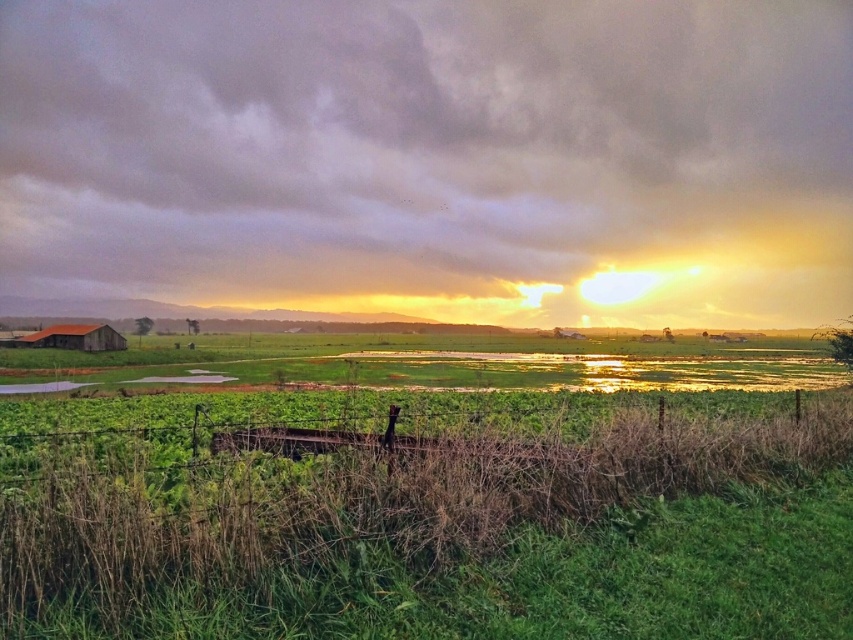
Question: Does cloudy sky at upper center appear over rustic wooden barn at lower left?

Choices:
 (A) yes
 (B) no

Answer: (A)

Question: Is cloudy sky at upper center wider than green grassy field at lower center?

Choices:
 (A) no
 (B) yes

Answer: (B)

Question: Which of these objects is positioned closest to the rustic wooden barn at lower left?

Choices:
 (A) green grassy field at lower center
 (B) cloudy sky at upper center

Answer: (A)

Question: Estimate the real-world distances between objects in this image. Which object is farther from the rustic wooden barn at lower left?

Choices:
 (A) cloudy sky at upper center
 (B) green grassy field at lower center

Answer: (A)

Question: Which object is farther from the camera taking this photo?

Choices:
 (A) rustic wooden barn at lower left
 (B) green grassy field at lower center
 (C) cloudy sky at upper center

Answer: (C)

Question: Can you confirm if cloudy sky at upper center is positioned to the left of green grassy field at lower center?

Choices:
 (A) no
 (B) yes

Answer: (B)